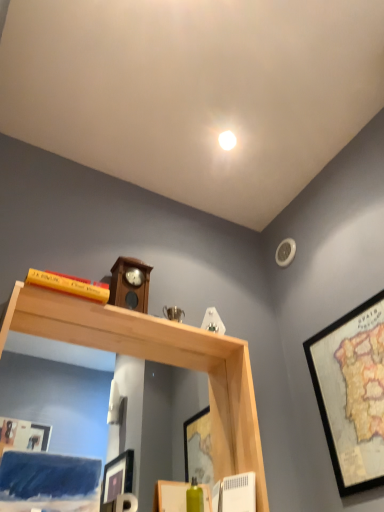
Question: Should I look upward or downward to see wooden framed map at right?

Choices:
 (A) up
 (B) down

Answer: (B)

Question: Does natural wood mirror at upper center appear on the right side of wooden clock at center?

Choices:
 (A) yes
 (B) no

Answer: (A)

Question: Is natural wood mirror at upper center surrounding wooden clock at center?

Choices:
 (A) yes
 (B) no

Answer: (B)

Question: Is natural wood mirror at upper center wider than wooden clock at center?

Choices:
 (A) yes
 (B) no

Answer: (A)

Question: Does natural wood mirror at upper center have a lesser height compared to wooden clock at center?

Choices:
 (A) no
 (B) yes

Answer: (A)

Question: From the image's perspective, is natural wood mirror at upper center under wooden clock at center?

Choices:
 (A) yes
 (B) no

Answer: (A)

Question: Are natural wood mirror at upper center and wooden clock at center located far from each other?

Choices:
 (A) yes
 (B) no

Answer: (B)

Question: Is wooden clock at center taller than yellow matte bookshelf at upper left?

Choices:
 (A) no
 (B) yes

Answer: (B)

Question: Is wooden clock at center smaller than yellow matte bookshelf at upper left?

Choices:
 (A) yes
 (B) no

Answer: (B)

Question: Is wooden clock at center behind yellow matte bookshelf at upper left?

Choices:
 (A) yes
 (B) no

Answer: (A)

Question: Could you tell me if wooden clock at center is facing yellow matte bookshelf at upper left?

Choices:
 (A) yes
 (B) no

Answer: (B)

Question: From the image's perspective, is wooden clock at center under yellow matte bookshelf at upper left?

Choices:
 (A) yes
 (B) no

Answer: (A)

Question: Is wooden clock at center touching yellow matte bookshelf at upper left?

Choices:
 (A) no
 (B) yes

Answer: (A)

Question: Does yellow matte bookshelf at upper left have a lesser width compared to wooden framed map at right?

Choices:
 (A) yes
 (B) no

Answer: (B)